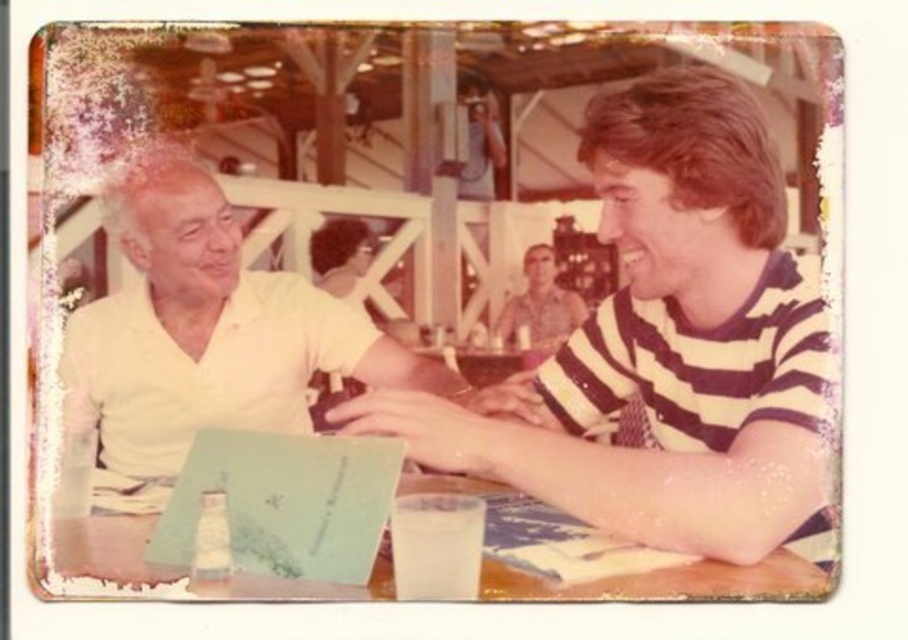
Based on the scene described, which object, the white matte shirt at left or the wooden table at lower left, occupies a greater area in the image?

The white matte shirt at left has a larger size compared to the wooden table at lower left, so it occupies a greater area in the image.

You are at a table in a vintage restaurant and want to place a small vase between the two points on the table. The coordinates of the points are point [71,364] and point [111,547]. Which point is closer to you if you are sitting at the table facing forward?

Point [71,364] is behind point [111,547], so the point closer to you would be point [111,547] since it is in front.

You are a photographer trying to frame a photo of two people sitting at a table. The scene includes a white matte shirt at upper left and a white matte shirt at left. How far apart are these two shirts in the image?

The white matte shirt at upper left and white matte shirt at left are 4.33 inches apart from each other.